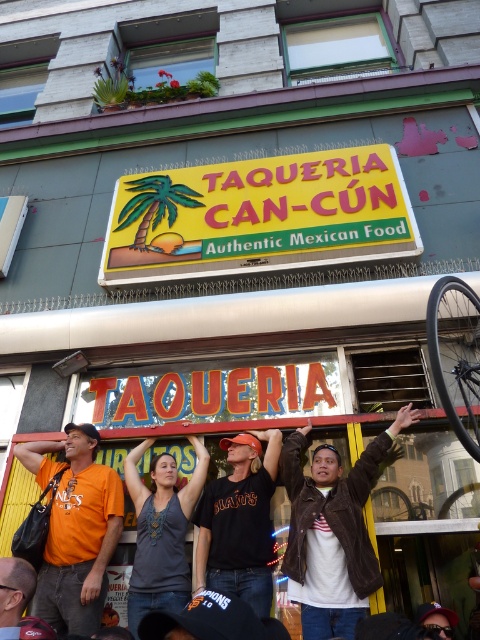
Question: Can you confirm if gray cotton tank top at center is wider than black matte bicycle wheel at right?

Choices:
 (A) yes
 (B) no

Answer: (B)

Question: Can you confirm if gray cotton tank top at center is wider than orange t-shirt at center?

Choices:
 (A) yes
 (B) no

Answer: (A)

Question: Can you confirm if yellowsignboard at center is thinner than orange t-shirt at center?

Choices:
 (A) yes
 (B) no

Answer: (B)

Question: Which object is closer to the camera taking this photo?

Choices:
 (A) brown leather jacket at center
 (B) orange t-shirt at left
 (C) gray cotton tank top at center
 (D) black cotton shirt at center

Answer: (A)

Question: Which of these objects is positioned farthest from the black cotton shirt at center?

Choices:
 (A) gray cotton tank top at center
 (B) orange t-shirt at center
 (C) black matte bicycle wheel at right

Answer: (C)

Question: Among these points, which one is nearest to the camera?

Choices:
 (A) (194, 468)
 (B) (381, 196)

Answer: (A)